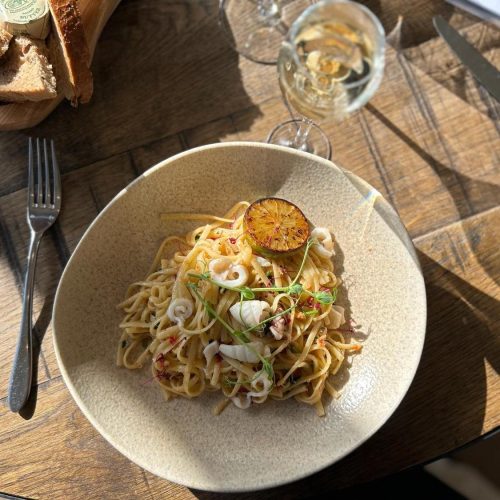
Image resolution: width=500 pixels, height=500 pixels. I want to click on base of wineglass, so click(315, 142).